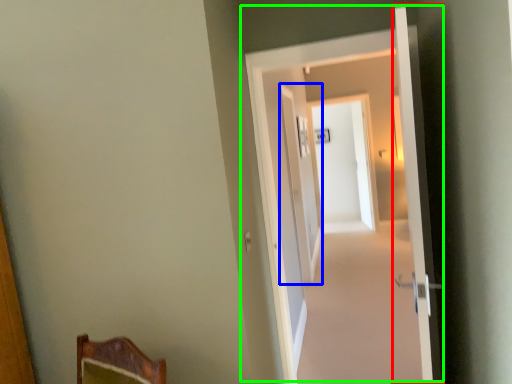
Question: Which object is positioned farthest from door (highlighted by a red box)? Select from screen door (highlighted by a blue box) and door (highlighted by a green box).

Choices:
 (A) screen door
 (B) door

Answer: (A)